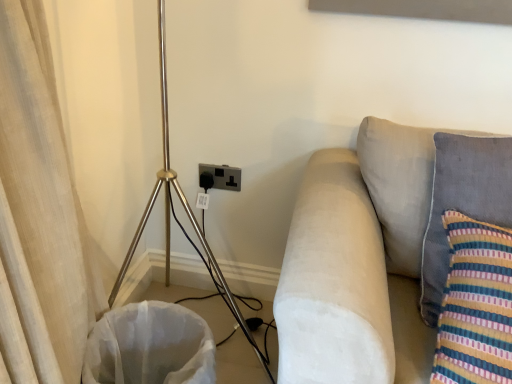
Question: In the image, is black plastic electric outlet at lower center on the left side or the right side of polished brass tripod at left?

Choices:
 (A) right
 (B) left

Answer: (A)

Question: From a real-world perspective, is black plastic electric outlet at lower center positioned above or below polished brass tripod at left?

Choices:
 (A) below
 (B) above

Answer: (A)

Question: Estimate the real-world distances between objects in this image. Which object is farther from the black plastic electric outlet at lower center?

Choices:
 (A) beige fabric curtain at left
 (B) white fabric laundry basket at lower left
 (C) suede beige couch at right
 (D) polished brass tripod at left
 (E) velvety gray pillow at right

Answer: (A)

Question: Estimate the real-world distances between objects in this image. Which object is farther from the polished brass tripod at left?

Choices:
 (A) black plastic electric outlet at lower center
 (B) white fabric laundry basket at lower left
 (C) suede beige couch at right
 (D) velvety gray pillow at right
 (E) beige fabric curtain at left

Answer: (D)